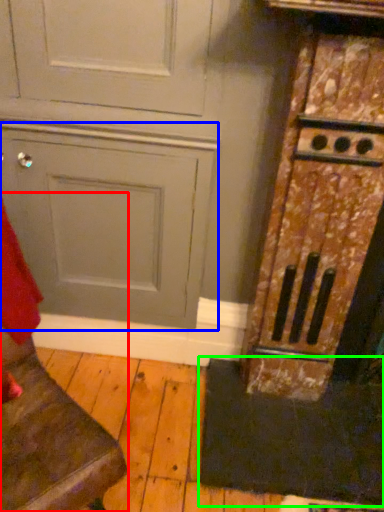
Question: Based on their relative distances, which object is farther from furniture (highlighted by a red box)? Choose from door (highlighted by a blue box) and doormat (highlighted by a green box).

Choices:
 (A) door
 (B) doormat

Answer: (B)